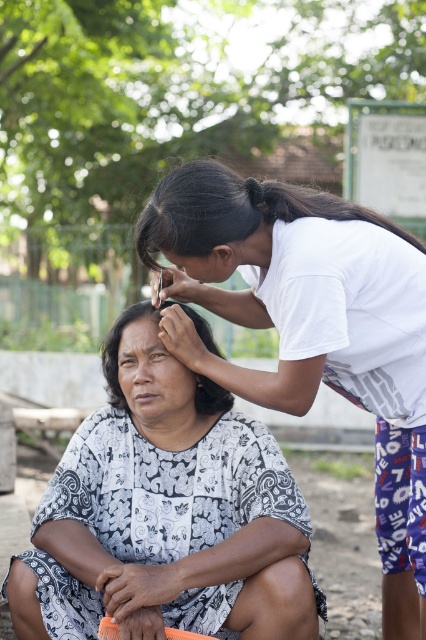
You are a photographer trying to capture the scene. You notice the white printed fabric at lower left and the black silky hair at upper center. Which object would you need to frame wider in your shot to ensure it fits properly?

The white printed fabric at lower left needs to be framed wider because its width is larger than the black silky hair at upper center.

You are a photographer trying to capture the best angle of the seated woman and the person trimming her hair. You want to ensure that the point at coordinates point (x=233, y=211) is visible in your shot. Where should you position your camera relative to the scene?

The point (x=233, y=211) is on the black silky hair at upper center. To ensure visibility, position the camera so it faces the upper center area where the seated woman is, focusing on her hair.